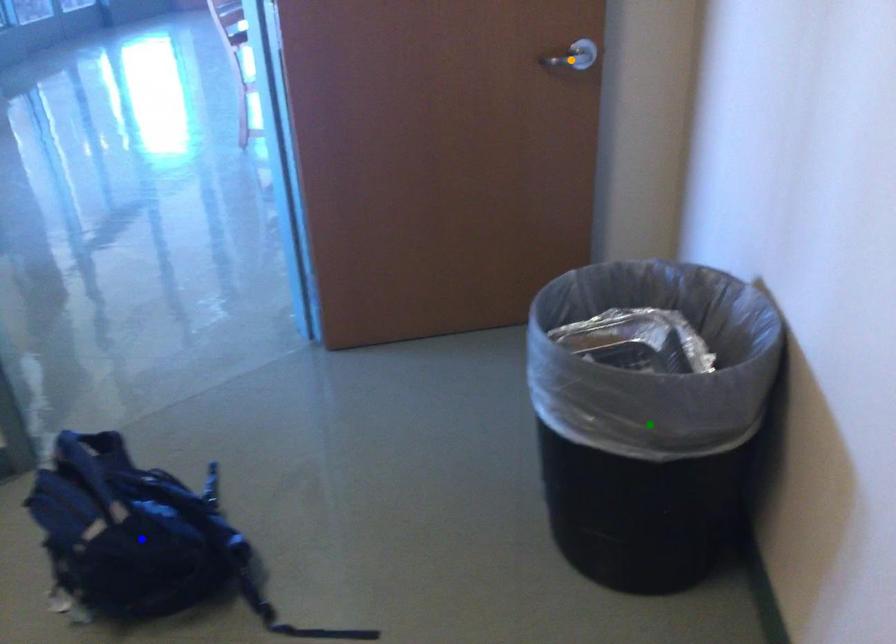
Order these from nearest to farthest:
orange point, green point, blue point

1. green point
2. blue point
3. orange point